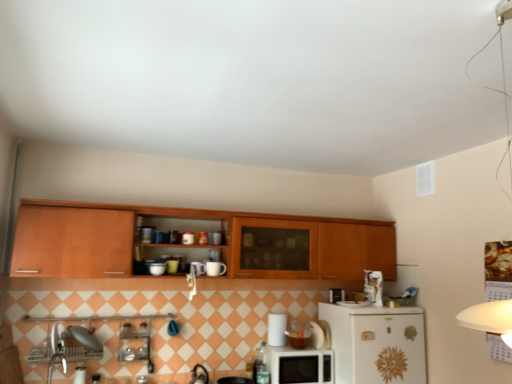
Question: Can you confirm if white glossy refrigerator at lower right is wider than white glossy microwave at lower center?

Choices:
 (A) no
 (B) yes

Answer: (B)

Question: Are white glossy refrigerator at lower right and white glossy microwave at lower center beside each other?

Choices:
 (A) yes
 (B) no

Answer: (B)

Question: From the image's perspective, would you say white glossy refrigerator at lower right is positioned over white glossy microwave at lower center?

Choices:
 (A) yes
 (B) no

Answer: (A)

Question: Is white glossy refrigerator at lower right turned away from white glossy microwave at lower center?

Choices:
 (A) no
 (B) yes

Answer: (A)

Question: From the image's perspective, is white glossy refrigerator at lower right under white glossy microwave at lower center?

Choices:
 (A) yes
 (B) no

Answer: (B)

Question: Is wooden cabinet at upper center spatially inside white glossy refrigerator at lower right, or outside of it?

Choices:
 (A) outside
 (B) inside

Answer: (A)

Question: From a real-world perspective, is wooden cabinet at upper center positioned above or below white glossy refrigerator at lower right?

Choices:
 (A) below
 (B) above

Answer: (B)

Question: Would you say wooden cabinet at upper center is to the left or to the right of white glossy refrigerator at lower right in the picture?

Choices:
 (A) left
 (B) right

Answer: (A)

Question: Considering the positions of wooden cabinet at upper center and white glossy refrigerator at lower right in the image, is wooden cabinet at upper center wider or thinner than white glossy refrigerator at lower right?

Choices:
 (A) wide
 (B) thin

Answer: (B)

Question: Considering the relative positions of white glossy microwave at center and white glossy refrigerator at lower right in the image provided, is white glossy microwave at center to the left or to the right of white glossy refrigerator at lower right?

Choices:
 (A) right
 (B) left

Answer: (B)

Question: Is white glossy microwave at center wider or thinner than white glossy refrigerator at lower right?

Choices:
 (A) wide
 (B) thin

Answer: (B)

Question: Is white glossy microwave at center taller or shorter than white glossy refrigerator at lower right?

Choices:
 (A) short
 (B) tall

Answer: (A)

Question: Relative to white glossy refrigerator at lower right, is white glossy microwave at center in front or behind?

Choices:
 (A) front
 (B) behind

Answer: (B)

Question: Considering the positions of point (422, 370) and point (282, 336), is point (422, 370) closer or farther from the camera than point (282, 336)?

Choices:
 (A) closer
 (B) farther

Answer: (A)

Question: From their relative heights in the image, would you say white glossy refrigerator at lower right is taller or shorter than white glossy microwave at center?

Choices:
 (A) short
 (B) tall

Answer: (B)